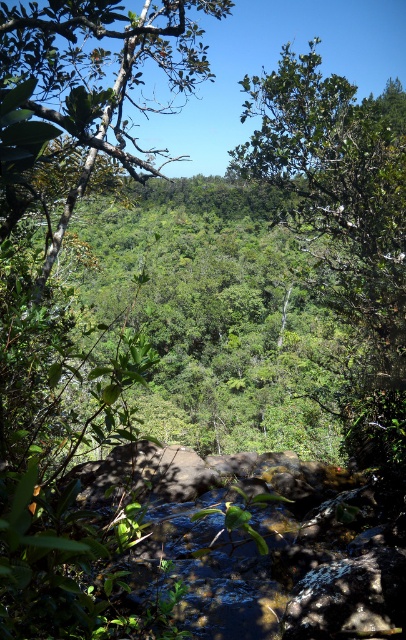
Does green leafy tree at center have a greater width compared to green leafy tree at upper left?

No, green leafy tree at center is not wider than green leafy tree at upper left.

Is point (382, 358) positioned in front of point (25, 67)?

Yes.

Is point (393, 186) positioned after point (15, 36)?

No, it is not.

Where is `green leafy tree at center`? green leafy tree at center is located at coordinates (343, 227).